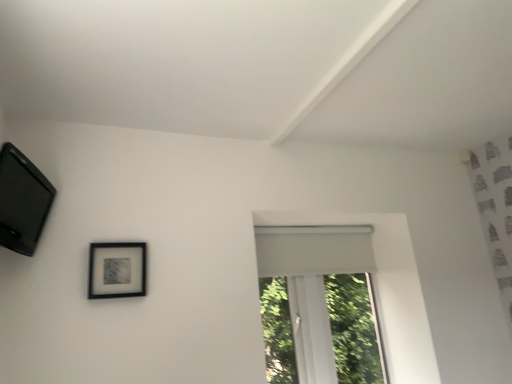
Question: Relative to matte black picture frame at upper left, the 1th picture frame ordered from the bottom, is white matte window at center in front or behind?

Choices:
 (A) front
 (B) behind

Answer: (B)

Question: From the image's perspective, is white matte window at center above or below matte black picture frame at upper left, the first picture frame from the back?

Choices:
 (A) above
 (B) below

Answer: (B)

Question: Based on their relative distances, which object is farther from the white matte window at center?

Choices:
 (A) black matte picture frame at upper left, the second picture frame in the back-to-front sequence
 (B) matte black picture frame at upper left, positioned as the second picture frame in top-to-bottom order

Answer: (A)

Question: Which is nearer to the black matte picture frame at upper left, arranged as the 1th picture frame when viewed from the top?

Choices:
 (A) white matte window at center
 (B) matte black picture frame at upper left, the first picture frame from the right

Answer: (B)